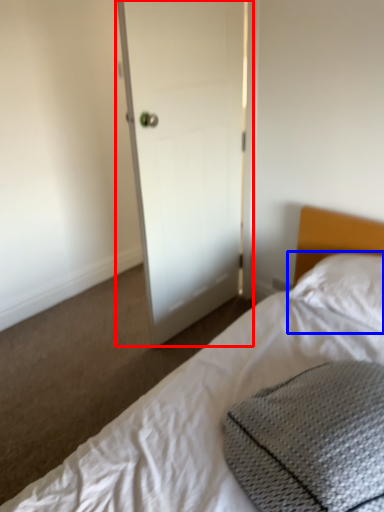
Question: Which of the following is the closest to the observer, door (highlighted by a red box) or pillow (highlighted by a blue box)?

Choices:
 (A) door
 (B) pillow

Answer: (B)